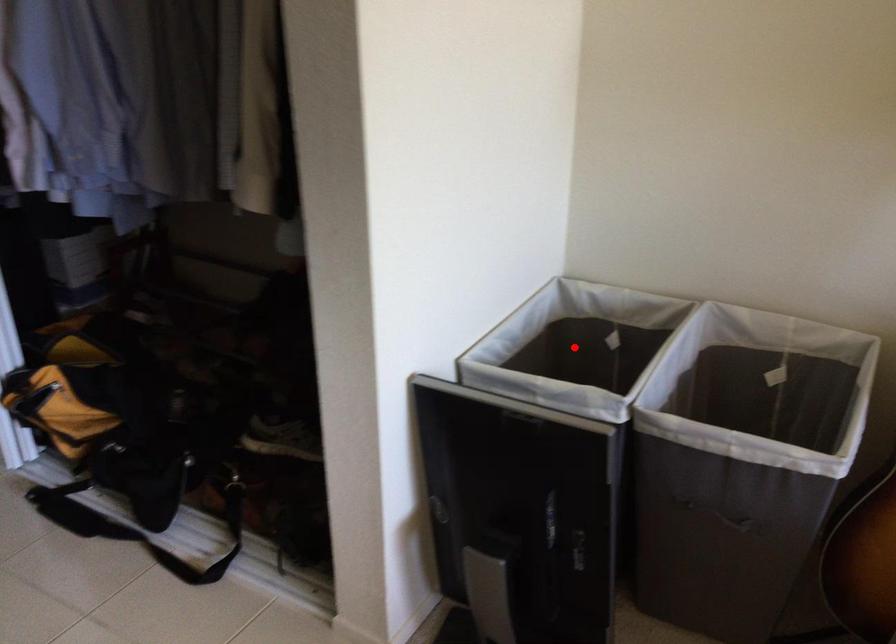
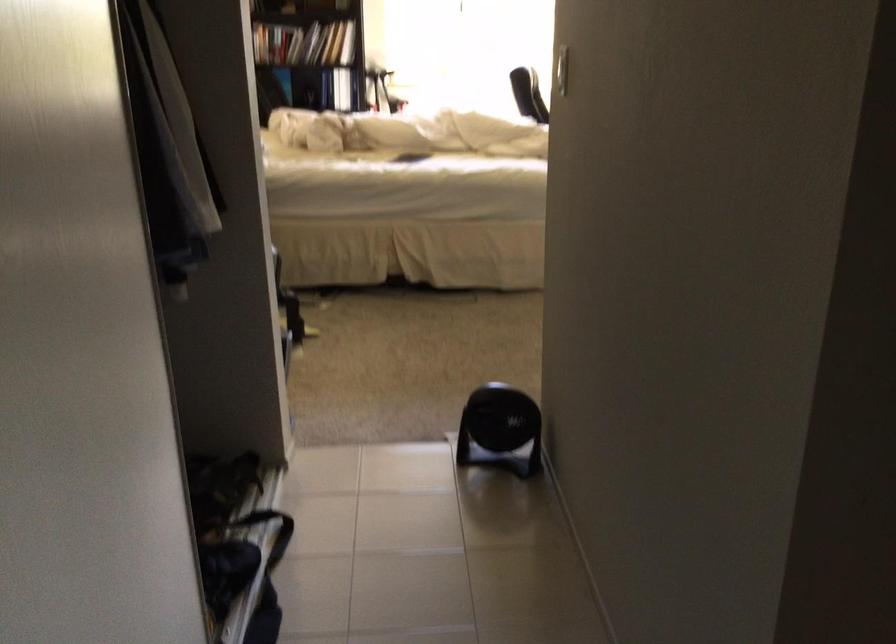
Question: I am providing you with two images of the same scene from different viewpoints. A red point is marked on the first image. Can you still see the location of the red point in image 2?

Choices:
 (A) Yes
 (B) No

Answer: (B)